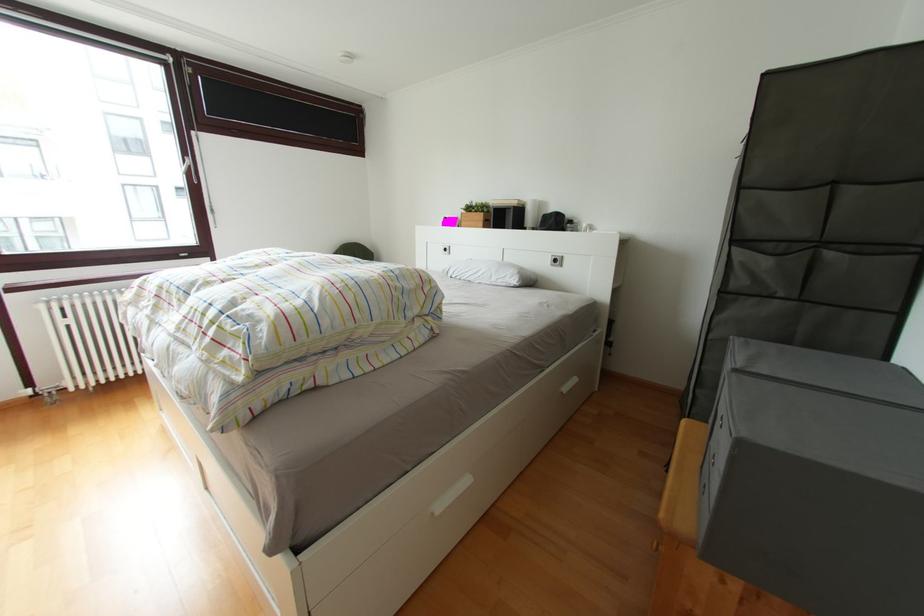
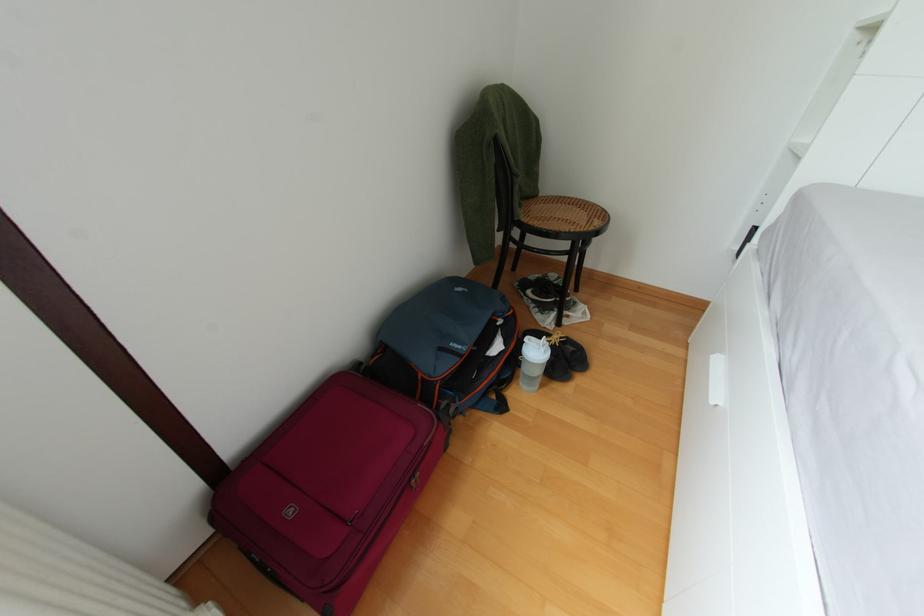
Which direction would the cameraman need to move to produce the second image?

The movement direction of the cameraman is left, forward.